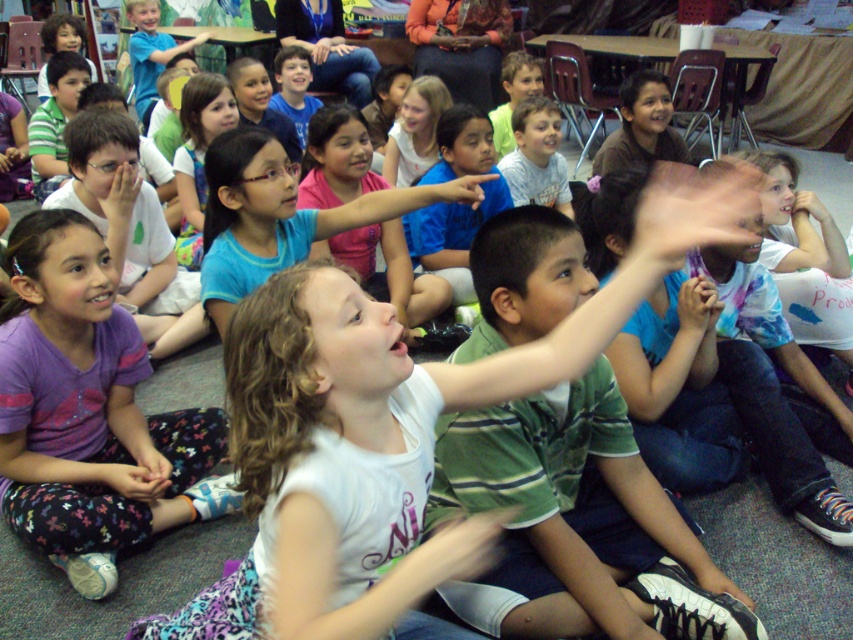
Question: Is blue jeans at upper center further to the viewer compared to blurred skin hand at center?

Choices:
 (A) no
 (B) yes

Answer: (B)

Question: Where is purple cotton shirt at lower left located in relation to matte tie-dye shirt at center in the image?

Choices:
 (A) left
 (B) right

Answer: (A)

Question: Among these points, which one is farthest from the camera?

Choices:
 (A) (68, 381)
 (B) (318, 26)

Answer: (B)

Question: Estimate the real-world distances between objects in this image. Which object is farther from the dark purple fabric at lower left?

Choices:
 (A) light blue shirt at center
 (B) matte skin hand at center
 (C) blue jeans at upper center

Answer: (C)

Question: Does matte skin hand at center lie behind white matte hand at upper right?

Choices:
 (A) no
 (B) yes

Answer: (A)

Question: Which of these objects is positioned farthest from the light blue shirt at center?

Choices:
 (A) blurred skin hand at center
 (B) orange fabric at upper center
 (C) white matte hand at upper right
 (D) dark purple fabric at lower left

Answer: (A)